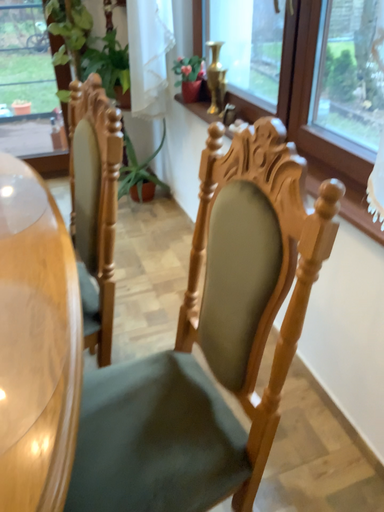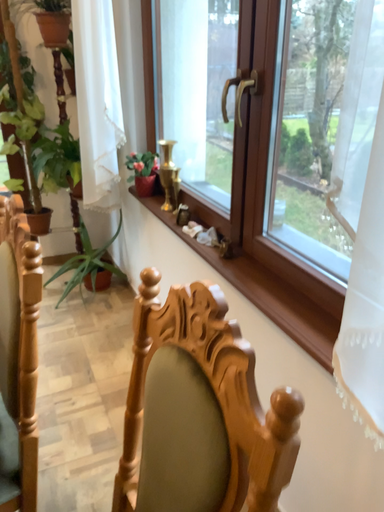
Question: How did the camera likely rotate when shooting the video?

Choices:
 (A) rotated downward
 (B) rotated upward

Answer: (B)